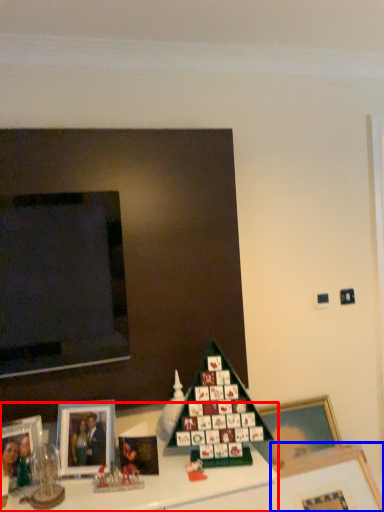
Question: Which object appears farthest to the camera in this image, furniture (highlighted by a red box) or picture frame (highlighted by a blue box)?

Choices:
 (A) furniture
 (B) picture frame

Answer: (B)